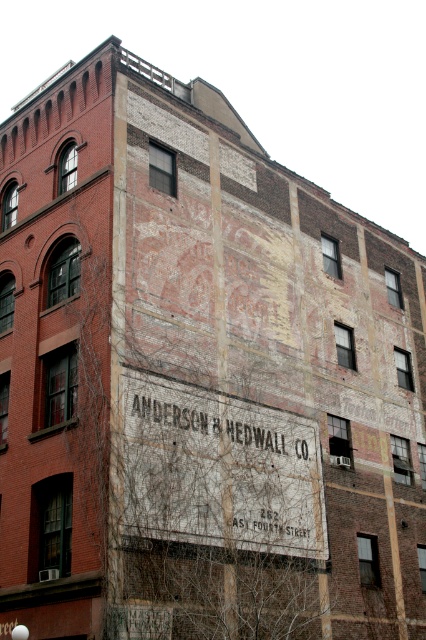
Is point (129, 403) positioned after point (287, 442)?

No, it is not.

Between white painted sign at center and white faded sign at center, which one is positioned lower?

white painted sign at center

Between point (187, 515) and point (166, 417), which one is positioned in front?

Point (187, 515)

You are a GUI agent. You are given a task and a screenshot of the screen. Output one action in this format:
    pyautogui.click(x=<x>, y=<y>)
    Task: Click on the white painted sign at center
    This screenshot has height=640, width=426.
    Given the screenshot: What is the action you would take?
    pyautogui.click(x=219, y=468)